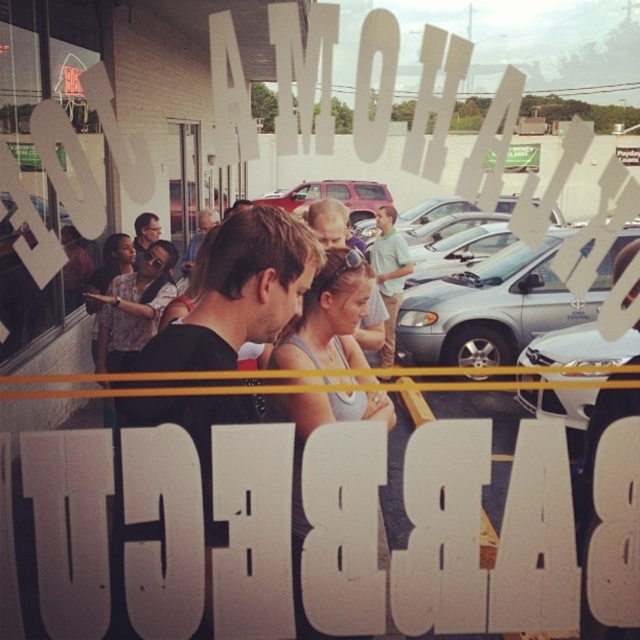
Between point (64, 243) and point (353, 296), which one is positioned in front?

Point (64, 243) is more forward.

Does transparent glass window at center have a greater width compared to matte gray tank top at center?

Incorrect, transparent glass window at center's width does not surpass matte gray tank top at center's.

Where is `transparent glass window at center`? The width and height of the screenshot is (640, 640). transparent glass window at center is located at coordinates (36, 156).

The height and width of the screenshot is (640, 640). What are the coordinates of `transparent glass window at center` in the screenshot? It's located at (36, 156).